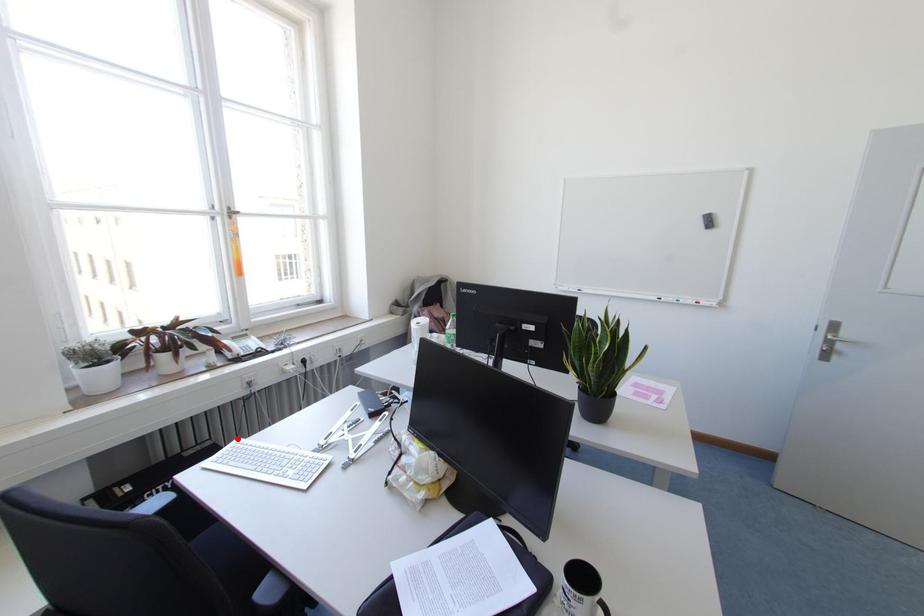
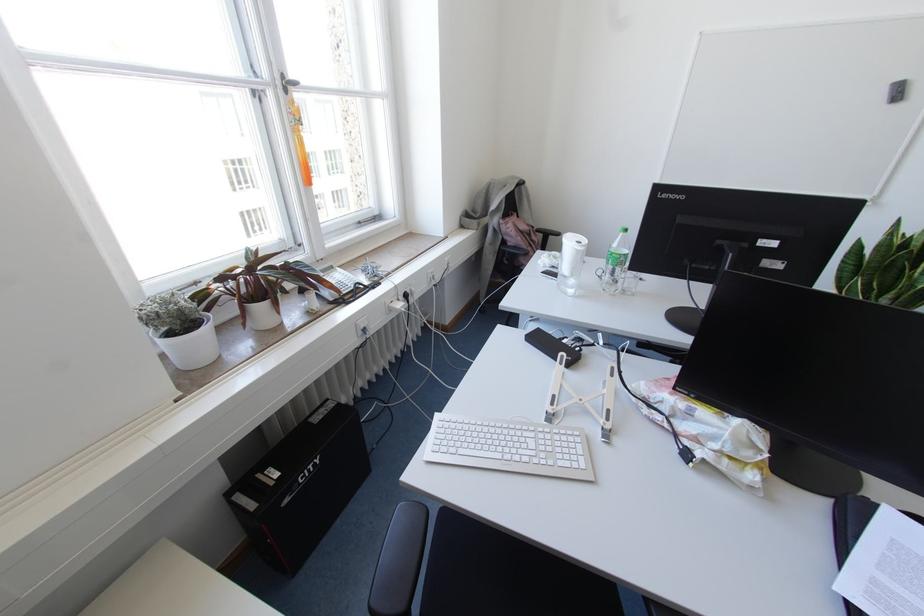
Question: I am providing you with two images of the same scene from different viewpoints. In image1, a red point is highlighted. Considering the same 3D point in image2, which of the following is correct?

Choices:
 (A) It is closer
 (B) It is farther

Answer: (A)